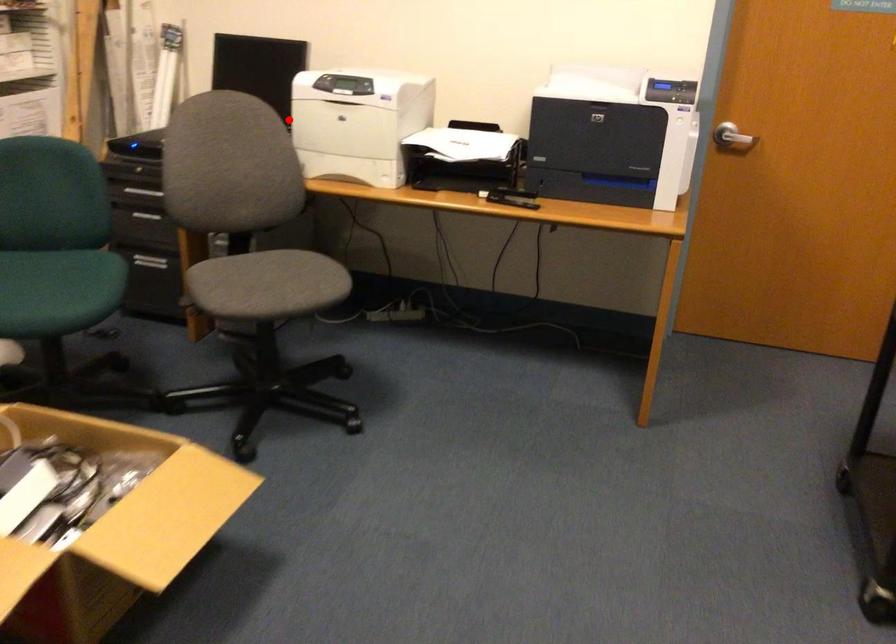
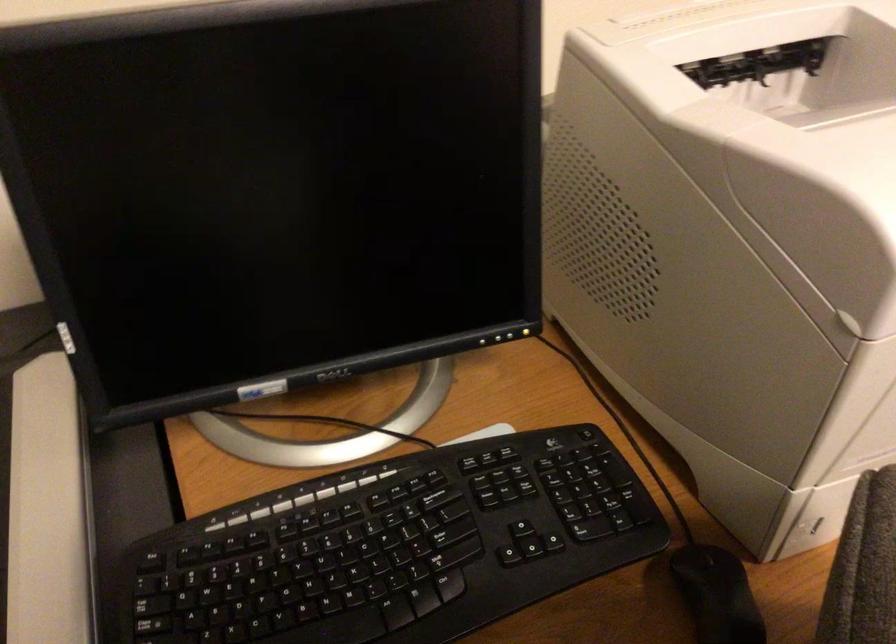
Find the pixel in the second image that matches the highlighted location in the first image.

(484, 341)